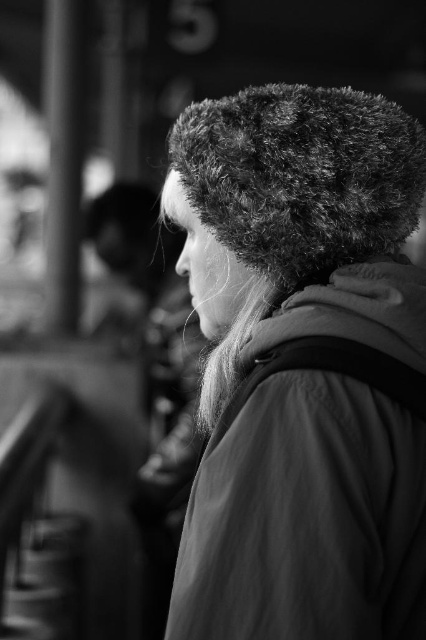
Question: Can you confirm if fuzzy fur hat at center is positioned to the right of fuzzy fur hat at upper center?

Choices:
 (A) yes
 (B) no

Answer: (B)

Question: Which object is farther from the camera taking this photo?

Choices:
 (A) fuzzy fur hat at upper center
 (B) fuzzy fur hat at center

Answer: (A)

Question: Where is fuzzy fur hat at center located in relation to fuzzy fur hat at upper center in the image?

Choices:
 (A) left
 (B) right

Answer: (A)

Question: Which point is closer to the camera?

Choices:
 (A) fuzzy fur hat at upper center
 (B) fuzzy fur hat at center

Answer: (B)

Question: Is fuzzy fur hat at center thinner than fuzzy fur hat at upper center?

Choices:
 (A) yes
 (B) no

Answer: (B)